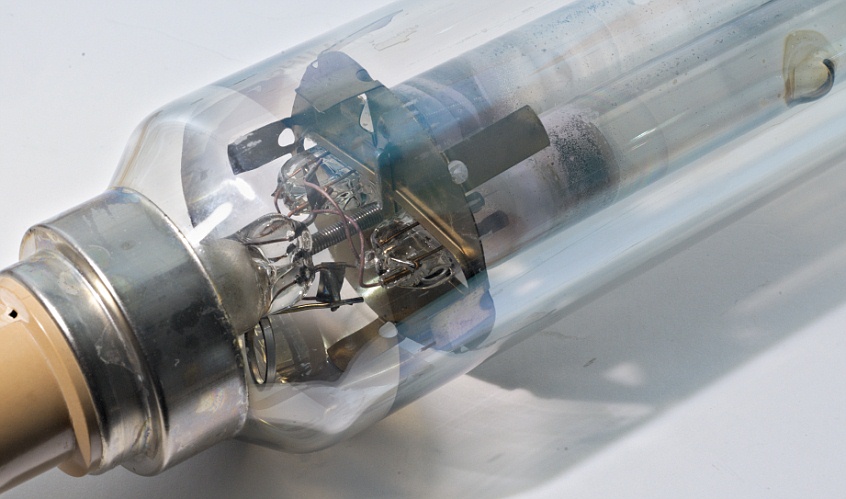
Locate an element on the screen. table is located at coordinates (753, 453).